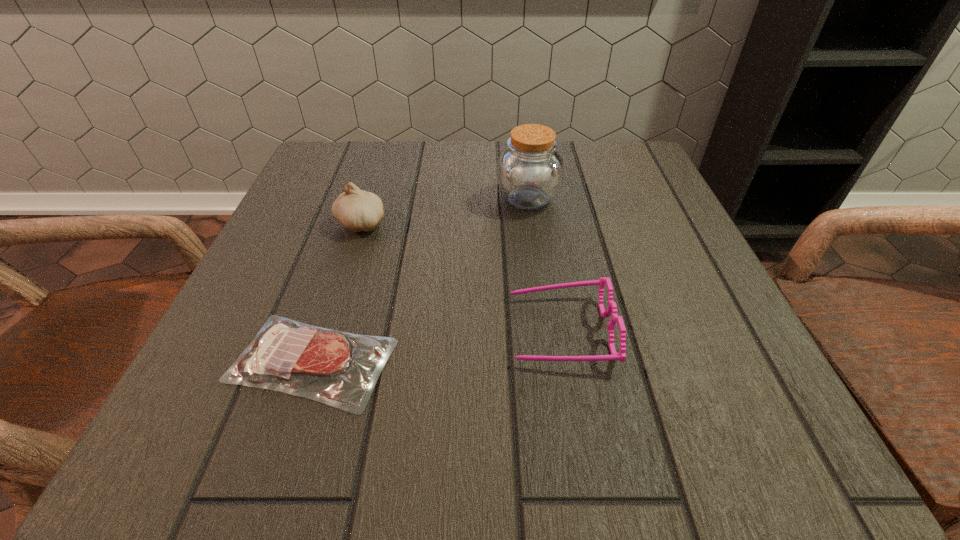
Locate an element on the screen. This screenshot has width=960, height=540. empty space that is in between the jar and the garlic is located at coordinates (444, 211).

Find the location of a particular element. empty space between the garlic and the tallest object is located at coordinates (444, 211).

At what (x,y) coordinates should I click in order to perform the action: click on object that stands as the closest to the third shortest object. Please return your answer as a coordinate pair (x, y). This screenshot has height=540, width=960. Looking at the image, I should click on (286, 355).

The width and height of the screenshot is (960, 540). I want to click on the closest object to the third tallest object, so click(x=286, y=355).

Locate an element on the screen. This screenshot has width=960, height=540. free spot that satisfies the following two spatial constraints: 1. on the arms of the second shortest object; 2. on the front side of the steak is located at coordinates (565, 361).

Find the location of a particular element. This screenshot has width=960, height=540. free space that satisfies the following two spatial constraints: 1. on the arms of the second shortest object; 2. on the front side of the shortest object is located at coordinates (565, 361).